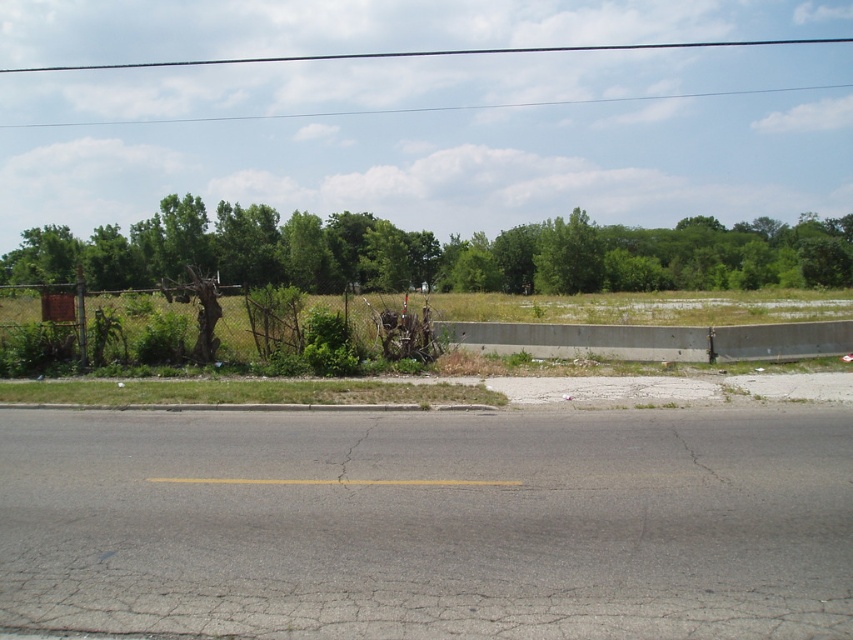
You are a hiker trying to navigate through the area. You see the green leafy tree at upper center and the rusty metal fence at left. Which object is higher in elevation?

The green leafy tree at upper center is above the rusty metal fence at left, so it is higher in elevation.

Looking at this image, you are a landscape architect designing a new pathway. You need to decide between placing it near the green leafy tree at upper center or the rusty metal fence at left. Which location would require more consideration due to the object being wider?

The green leafy tree at upper center might be wider than the rusty metal fence at left, so placing the pathway near the green leafy tree at upper center would require more consideration due to its potential width.